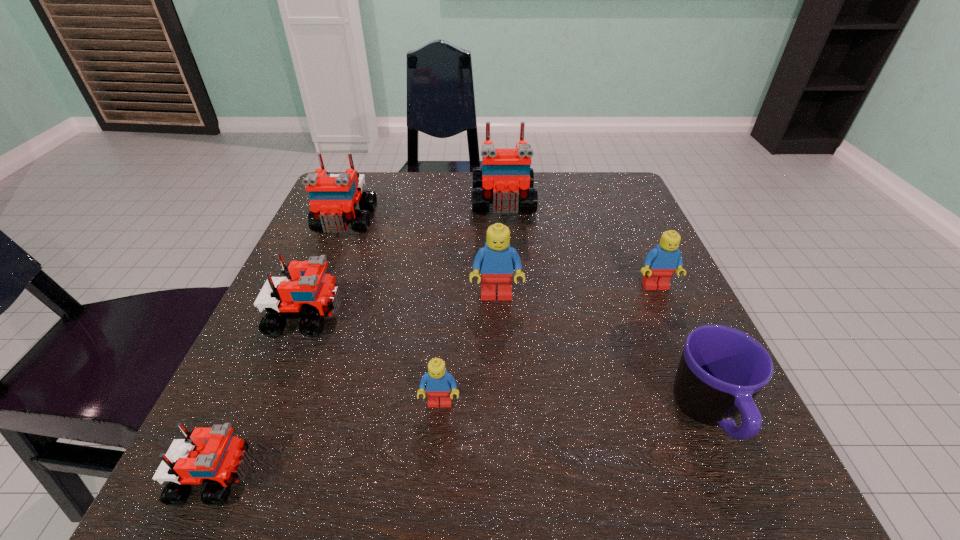
You are a GUI agent. You are given a task and a screenshot of the screen. Output one action in this format:
    pyautogui.click(x=<x>, y=<y>)
    Task: Click on the free location that satisfies the following two spatial constraints: 1. with the handle on the side of the black mug; 2. on the front-facing side of the nearest red Lego
    The image size is (960, 540).
    Given the screenshot: What is the action you would take?
    pyautogui.click(x=734, y=477)